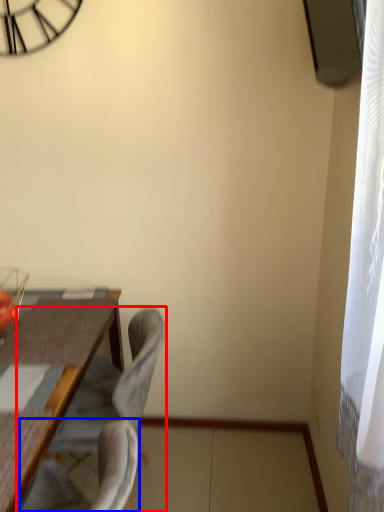
Question: Which point is closer to the camera, chair (highlighted by a red box) or swivel chair (highlighted by a blue box)?

Choices:
 (A) chair
 (B) swivel chair

Answer: (B)